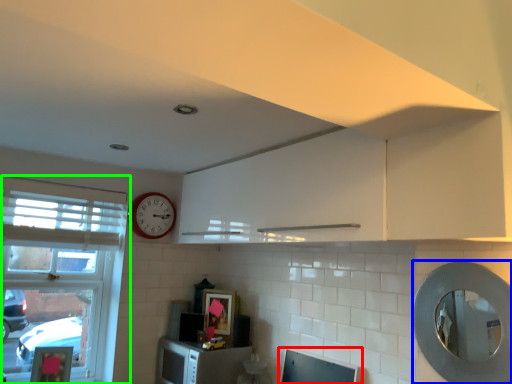
Question: Which object is positioned farthest from computer monitor (highlighted by a red box)? Select from oval (highlighted by a blue box) and window (highlighted by a green box).

Choices:
 (A) oval
 (B) window

Answer: (B)